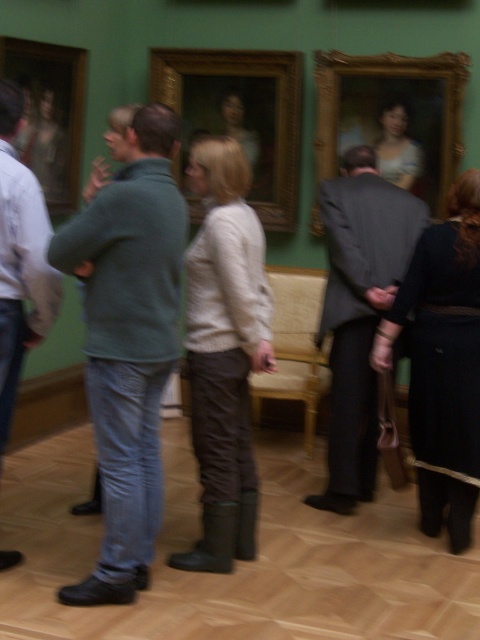
Question: Which object appears closest to the camera in this image?

Choices:
 (A) wooden framed portrait at center
 (B) gold ornate frame at upper center
 (C) wooden frame at left

Answer: (C)

Question: Is matte brown pants at center to the left of black leather dress at lower right from the viewer's perspective?

Choices:
 (A) yes
 (B) no

Answer: (A)

Question: Which point is farther from the camera taking this photo?

Choices:
 (A) (203, 262)
 (B) (472, 259)
 (C) (355, 140)

Answer: (C)

Question: In this image, where is black leather dress at lower right located relative to wooden frame at left?

Choices:
 (A) above
 (B) below

Answer: (B)

Question: Can you confirm if wooden framed portrait at center is thinner than wooden frame at left?

Choices:
 (A) yes
 (B) no

Answer: (B)

Question: Which point is farther from the camera taking this photo?

Choices:
 (A) (439, 68)
 (B) (67, 54)
 (C) (243, 324)
 (D) (182, 92)

Answer: (D)